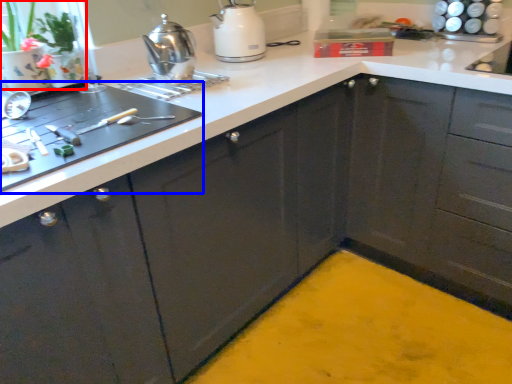
Question: Which object appears closest to the camera in this image, plant (highlighted by a red box) or home appliance (highlighted by a blue box)?

Choices:
 (A) plant
 (B) home appliance

Answer: (B)